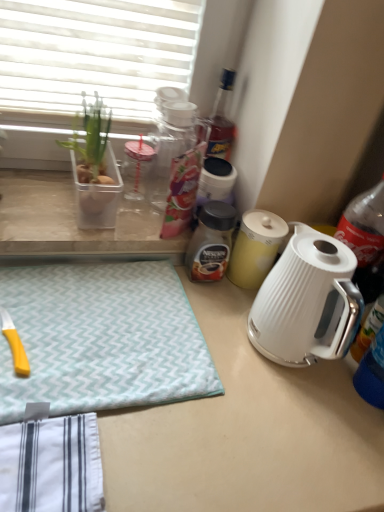
Question: Considering the positions of white glossy electric kettle at center and brown glass jar at center in the image, is white glossy electric kettle at center bigger or smaller than brown glass jar at center?

Choices:
 (A) big
 (B) small

Answer: (A)

Question: Relative to brown glass jar at center, is white glossy electric kettle at center in front or behind?

Choices:
 (A) front
 (B) behind

Answer: (A)

Question: Which object is the farthest from the brown glass jar at center?

Choices:
 (A) white glossy electric kettle at center-right
 (B) teal zigzag fabric at lower left
 (C) clear plastic container at left
 (D) yellow matte canister at center
 (E) white glossy electric kettle at center

Answer: (E)

Question: Estimate the real-world distances between objects in this image. Which object is farther from the white glossy electric kettle at center?

Choices:
 (A) teal zigzag fabric at lower left
 (B) yellow matte canister at center
 (C) white glossy electric kettle at center-right
 (D) clear plastic container at left
 (E) clear plastic container at upper left

Answer: (E)